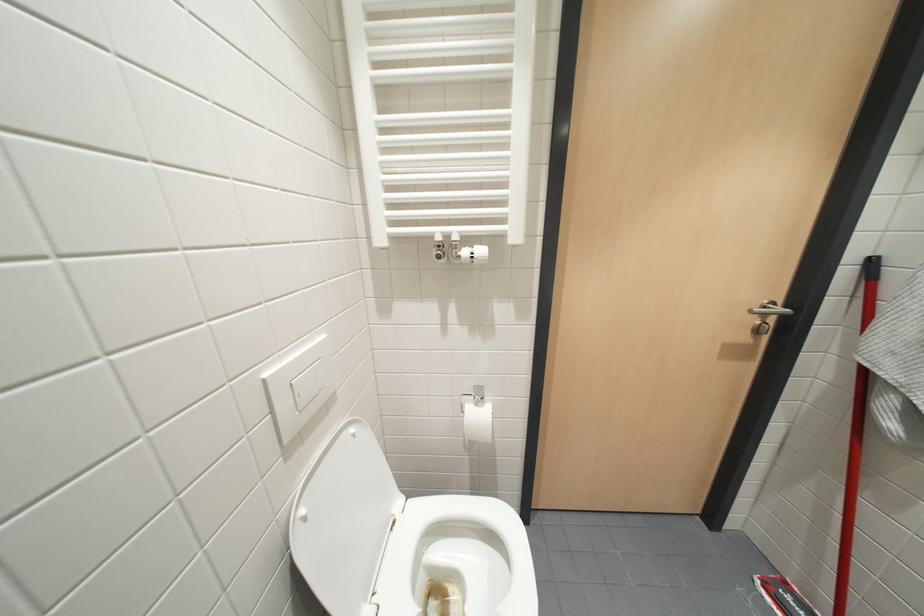
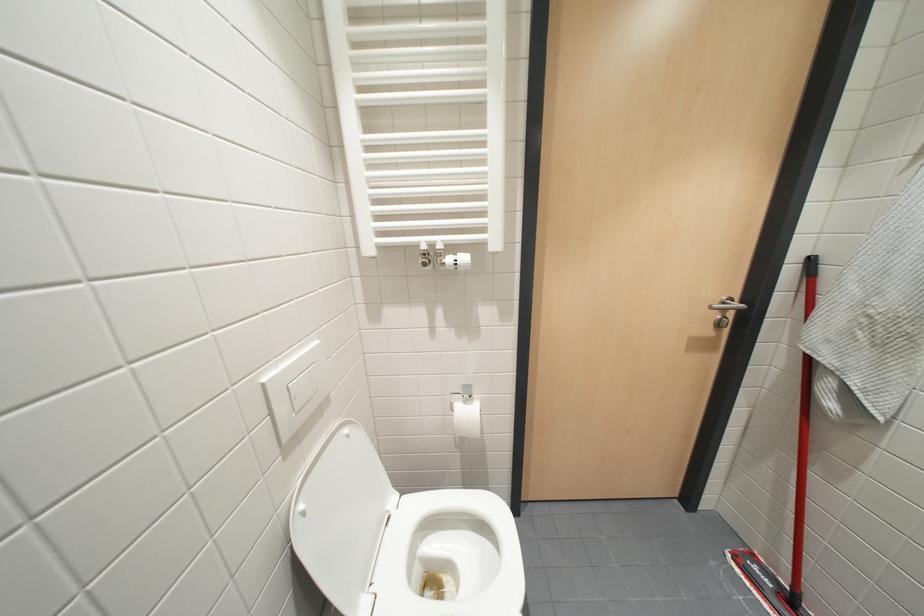
Question: The camera is either moving clockwise (left) or counter-clockwise (right) around the object. The first image is from the beginning of the video and the second image is from the end. Is the camera moving left or right when shooting the video?

Choices:
 (A) Left
 (B) Right

Answer: (A)